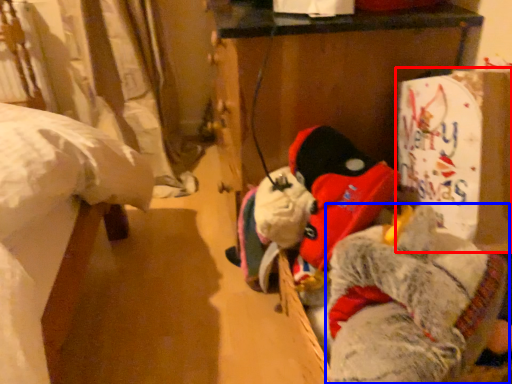
Question: Among these objects, which one is farthest to the camera, cardboard box (highlighted by a red box) or animal (highlighted by a blue box)?

Choices:
 (A) cardboard box
 (B) animal

Answer: (A)